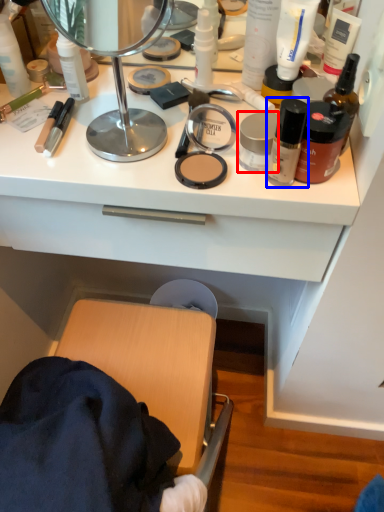
Question: Which point is closer to the camera, toiletry (highlighted by a red box) or toiletry (highlighted by a blue box)?

Choices:
 (A) toiletry
 (B) toiletry

Answer: (B)